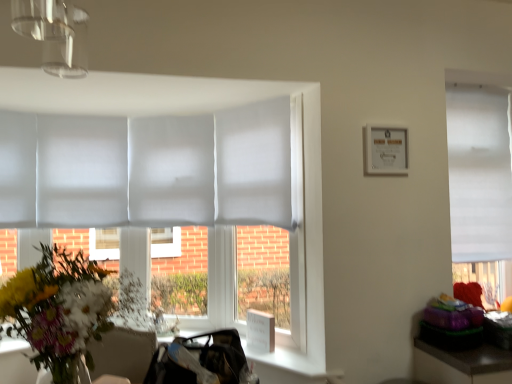
Question: Considering the relative sizes of white paper picture frame at upper right and white matte window at right in the image provided, is white paper picture frame at upper right wider than white matte window at right?

Choices:
 (A) no
 (B) yes

Answer: (A)

Question: From a real-world perspective, is white paper picture frame at upper right on white matte window at right?

Choices:
 (A) no
 (B) yes

Answer: (B)

Question: Is white paper picture frame at upper right oriented away from white matte window at right?

Choices:
 (A) yes
 (B) no

Answer: (B)

Question: Is white paper picture frame at upper right shorter than white matte window at right?

Choices:
 (A) no
 (B) yes

Answer: (B)

Question: Considering the relative sizes of white paper picture frame at upper right and white matte window at right in the image provided, is white paper picture frame at upper right taller than white matte window at right?

Choices:
 (A) yes
 (B) no

Answer: (B)

Question: Are white paper picture frame at upper right and white matte window at right far apart?

Choices:
 (A) no
 (B) yes

Answer: (A)

Question: From the image's perspective, is white matte window at right located above vibrant floral bouquet at left?

Choices:
 (A) no
 (B) yes

Answer: (B)

Question: Is white matte window at right taller than vibrant floral bouquet at left?

Choices:
 (A) no
 (B) yes

Answer: (B)

Question: Is white matte window at right shorter than vibrant floral bouquet at left?

Choices:
 (A) no
 (B) yes

Answer: (A)

Question: Is white matte window at right positioned far away from vibrant floral bouquet at left?

Choices:
 (A) yes
 (B) no

Answer: (A)

Question: Is white matte window at right at the left side of vibrant floral bouquet at left?

Choices:
 (A) no
 (B) yes

Answer: (A)

Question: Is the depth of white matte window at right less than that of vibrant floral bouquet at left?

Choices:
 (A) no
 (B) yes

Answer: (A)

Question: Can you confirm if white paper picture frame at upper right is shorter than vibrant floral bouquet at left?

Choices:
 (A) no
 (B) yes

Answer: (B)